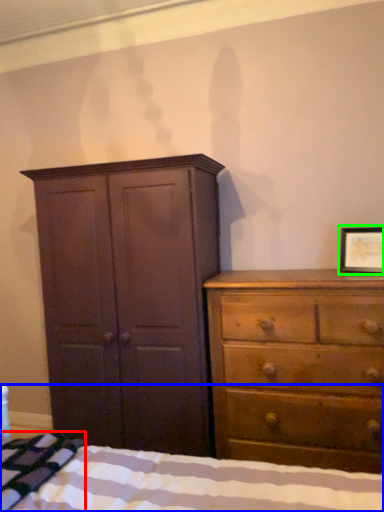
Question: Based on their relative distances, which object is nearer to blanket (highlighted by a red box)? Choose from bed (highlighted by a blue box) and picture frame (highlighted by a green box).

Choices:
 (A) bed
 (B) picture frame

Answer: (A)